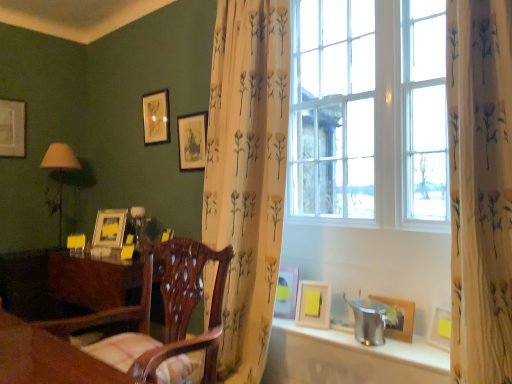
Question: From a real-world perspective, is wooden chair at center above or below matte wooden picture frame at upper center, arranged as the fourth picture frame when viewed from the back?

Choices:
 (A) below
 (B) above

Answer: (A)

Question: In the image, is wooden chair at center positioned in front of or behind matte wooden picture frame at upper center, the fourth picture frame in the right-to-left sequence?

Choices:
 (A) front
 (B) behind

Answer: (A)

Question: Estimate the real-world distances between objects in this image. Which object is closer to the matte white picture frame at center, which appears as the third picture frame when viewed from the front?

Choices:
 (A) metallic silver bucket at lower right
 (B) wooden table at lower left
 (C) wooden chair at center
 (D) wooden picture frame at lower right, which ranks as the 1th picture frame in right-to-left order
 (E) matte wooden picture frame at upper center, arranged as the fourth picture frame when viewed from the back

Answer: (A)

Question: Which object is the closest to the matte wooden picture frame at upper center, arranged as the 4th picture frame when viewed from the left?

Choices:
 (A) matte white picture frame at center, the 3th picture frame positioned from the right
 (B) wooden picture frame at lower right, marked as the 7th picture frame in a left-to-right arrangement
 (C) matte gold picture frame at upper center, the third picture frame viewed from the back
 (D) metallic silver bucket at lower right
 (E) matte white picture frame at upper right, acting as the second picture frame starting from the front

Answer: (C)